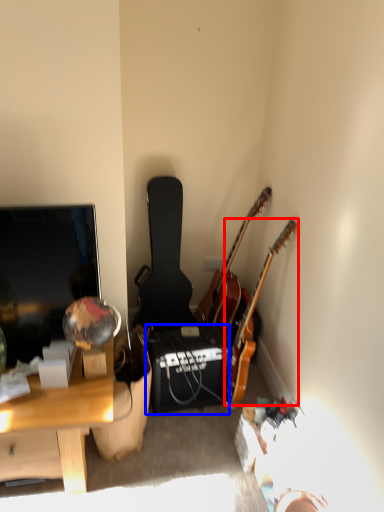
Question: Which of the following is the farthest to the observer, guitar (highlighted by a red box) or loudspeaker (highlighted by a blue box)?

Choices:
 (A) guitar
 (B) loudspeaker

Answer: (B)